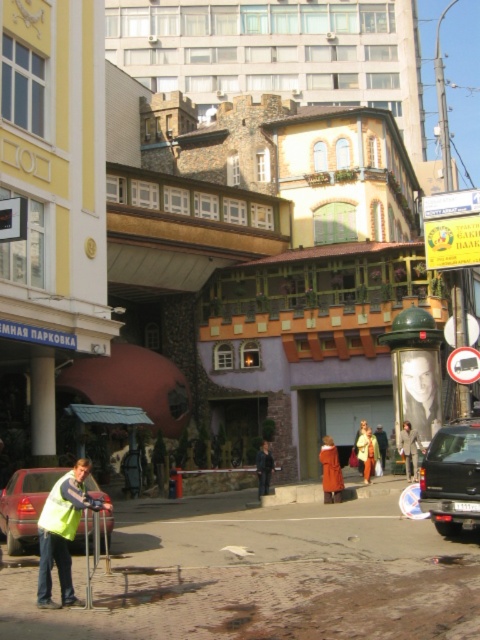
You are a pedestrian standing on the sidewalk and see the matte red car at lower left and the smooth gray portrait at center. Which object is positioned lower in the scene?

The matte red car at lower left is located below the smooth gray portrait at center, so it is positioned lower in the scene.